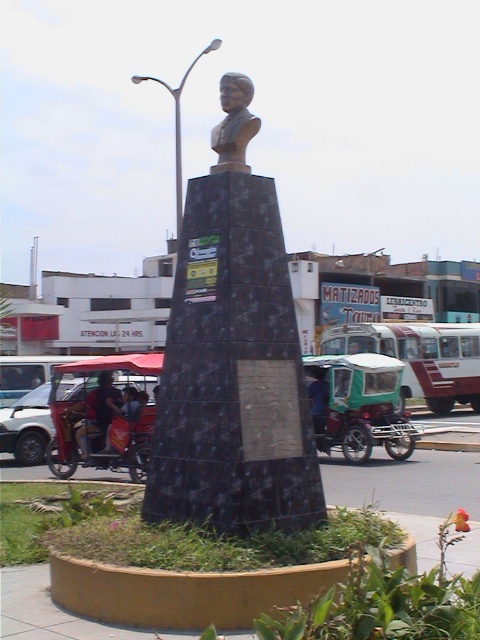
Does green plastic motorcycle at center appear on the left side of metallic gold motorcycle at center-left?

In fact, green plastic motorcycle at center is to the right of metallic gold motorcycle at center-left.

Is the position of green plastic motorcycle at center more distant than that of metallic gold motorcycle at center-left?

Yes, it is behind metallic gold motorcycle at center-left.

At what (x,y) coordinates should I click in order to perform the action: click on green plastic motorcycle at center. Please return your answer as a coordinate pair (x, y). This screenshot has height=640, width=480. Looking at the image, I should click on (359, 404).

Is point (233, 86) positioned after point (180, 83)?

No, it is not.

Does point (231, 140) come in front of point (179, 154)?

Yes, it is in front of point (179, 154).

Where is `bronze bust at center`? bronze bust at center is located at coordinates (233, 122).

Can you confirm if black marble bust at center is bigger than green plastic motorcycle at center?

Yes.

Which is behind, point (218, 212) or point (396, 380)?

The point (396, 380) is behind.

Which is in front, point (241, 248) or point (379, 372)?

Point (241, 248)

Locate an element on the screen. black marble bust at center is located at coordinates (232, 355).